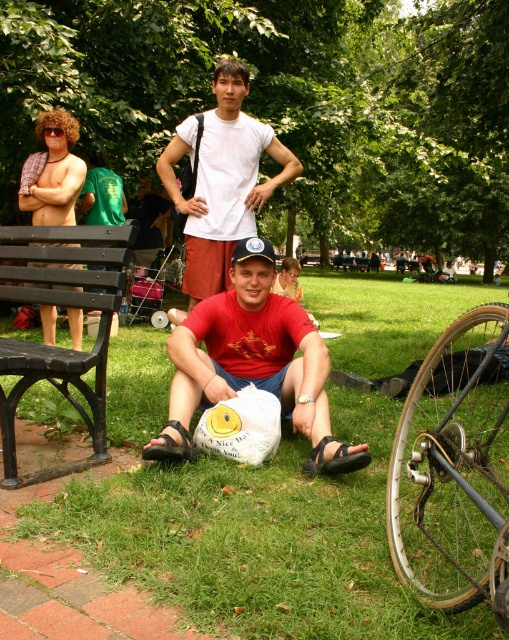
Question: Which of these objects is positioned closest to the green grass at lower center?

Choices:
 (A) plaid shirt at left
 (B) green fabric backpack at upper left
 (C) black wood bench at left

Answer: (C)

Question: Can you confirm if black wood bench at left is wider than green fabric backpack at upper left?

Choices:
 (A) no
 (B) yes

Answer: (B)

Question: Which of these objects is positioned closest to the white cotton t-shirt at center?

Choices:
 (A) green fabric backpack at upper left
 (B) gold metallic bicycle wheel at lower right
 (C) plaid shirt at left
 (D) green grass at lower center

Answer: (C)

Question: Can you confirm if gold metallic bicycle wheel at lower right is positioned below matte red t-shirt at center?

Choices:
 (A) no
 (B) yes

Answer: (B)

Question: Is gold metallic bicycle wheel at lower right to the right of plaid shirt at left from the viewer's perspective?

Choices:
 (A) yes
 (B) no

Answer: (A)

Question: Among these objects, which one is farthest from the camera?

Choices:
 (A) black wood bench at left
 (B) green fabric backpack at upper left
 (C) matte red t-shirt at center
 (D) gold metallic bicycle wheel at lower right

Answer: (B)